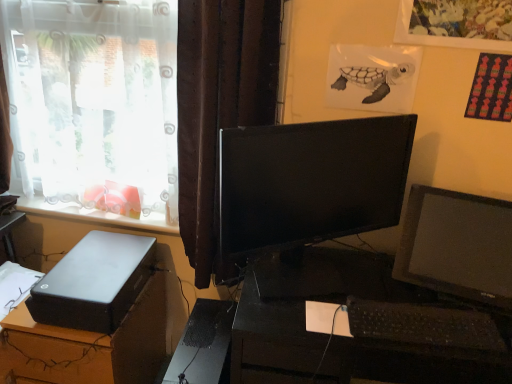
The width and height of the screenshot is (512, 384). Describe the element at coordinates (95, 106) in the screenshot. I see `transparent fabric window at left` at that location.

This screenshot has height=384, width=512. What are the coordinates of `black glossy monitor at center` in the screenshot? It's located at (311, 181).

Find the location of a particular element. white plastic window sill at lower left is located at coordinates (91, 213).

Describe the element at coordinates (91, 213) in the screenshot. This screenshot has width=512, height=384. I see `white plastic window sill at lower left` at that location.

I want to click on black matte computer tower at lower left, so click(x=204, y=345).

The width and height of the screenshot is (512, 384). What do you see at coordinates (204, 345) in the screenshot?
I see `black matte computer tower at lower left` at bounding box center [204, 345].

Locate an element on the screen. The image size is (512, 384). satin black desktop at lower left, which is counted as the first desk, starting from the left is located at coordinates (89, 345).

What do you see at coordinates (304, 307) in the screenshot? This screenshot has width=512, height=384. I see `black plastic desk at center, the second desk from the left` at bounding box center [304, 307].

Where is `matte black hard drive at lower left`? matte black hard drive at lower left is located at coordinates (94, 282).

Identify the location of transparent fabric window at left. (95, 106).

Which of these two, satin black desktop at lower left, which is counted as the 2th desk, starting from the right, or black glossy monitor at center, stands taller?

satin black desktop at lower left, which is counted as the 2th desk, starting from the right, is taller.

Can black glossy monitor at center be found inside satin black desktop at lower left, which is counted as the 2th desk, starting from the right?

No.

Is satin black desktop at lower left, which is counted as the first desk, starting from the left, in front of black glossy monitor at center?

No, it is behind black glossy monitor at center.

From the image's perspective, between black glossy monitor at center and brown textured curtain at center, which one is located above?

brown textured curtain at center is shown above in the image.

Is black glossy monitor at center to the left of brown textured curtain at center from the viewer's perspective?

No, black glossy monitor at center is not to the left of brown textured curtain at center.

Considering the sizes of black glossy monitor at center and brown textured curtain at center in the image, is black glossy monitor at center taller or shorter than brown textured curtain at center?

Clearly, black glossy monitor at center is shorter compared to brown textured curtain at center.

Between black glossy monitor at center and brown textured curtain at center, which one has larger width?

brown textured curtain at center is wider.

From the image's perspective, is matte black hard drive at lower left located above transparent fabric window at left?

Incorrect, from the image's perspective, matte black hard drive at lower left is lower than transparent fabric window at left.

Is the surface of matte black hard drive at lower left in direct contact with transparent fabric window at left?

matte black hard drive at lower left and transparent fabric window at left are clearly separated.

Is point (131, 262) closer or farther from the camera than point (24, 182)?

Clearly, point (131, 262) is closer to the camera than point (24, 182).

Which of these two, matte black hard drive at lower left or transparent fabric window at left, stands shorter?

Standing shorter between the two is matte black hard drive at lower left.

Which object is closer to the camera taking this photo, black matte computer tower at lower left or transparent fabric window at left?

black matte computer tower at lower left is in front.

Considering the positions of objects black matte computer tower at lower left and transparent fabric window at left in the image provided, who is more to the left, black matte computer tower at lower left or transparent fabric window at left?

Positioned to the left is transparent fabric window at left.

From the picture: Measure the distance from black matte computer tower at lower left to transparent fabric window at left.

black matte computer tower at lower left is 28.64 inches from transparent fabric window at left.

Can we say black matte computer tower at lower left lies outside transparent fabric window at left?

Yes, black matte computer tower at lower left is not within transparent fabric window at left.

From the image's perspective, is black glossy monitor at center located above black plastic keyboard at lower right?

Indeed, from the image's perspective, black glossy monitor at center is shown above black plastic keyboard at lower right.

Is black glossy monitor at center in contact with black plastic keyboard at lower right?

black glossy monitor at center is not next to black plastic keyboard at lower right, and they're not touching.

Is black glossy monitor at center facing towards black plastic keyboard at lower right?

Yes, black glossy monitor at center is turned towards black plastic keyboard at lower right.

Is white plastic window sill at lower left aimed at matte black hard drive at lower left?

No, white plastic window sill at lower left is not aimed at matte black hard drive at lower left.

Who is taller, white plastic window sill at lower left or matte black hard drive at lower left?

matte black hard drive at lower left is taller.

Does white plastic window sill at lower left contain matte black hard drive at lower left?

No, matte black hard drive at lower left is located outside of white plastic window sill at lower left.

Is point (59, 208) farther from viewer compared to point (86, 239)?

Yes.

Between black plastic desk at center, the second desk from the left, and transparent fabric window at left, which one has smaller size?

transparent fabric window at left is smaller.

Is black plastic desk at center, the second desk from the left, facing away from transparent fabric window at left?

black plastic desk at center, the second desk from the left, is not turned away from transparent fabric window at left.

Which object is more forward, black plastic desk at center, which is counted as the 1th desk, starting from the right, or transparent fabric window at left?

black plastic desk at center, which is counted as the 1th desk, starting from the right, is more forward.

Based on the photo, from the image's perspective, between black plastic desk at center, which is counted as the 1th desk, starting from the right, and transparent fabric window at left, who is located below?

black plastic desk at center, which is counted as the 1th desk, starting from the right, is shown below in the image.

Locate an element on the screen. This screenshot has height=384, width=512. computer monitor that is in front of the satin black desktop at lower left, which is counted as the 2th desk, starting from the right is located at coordinates (311, 181).

Find the location of a particular element. The image size is (512, 384). curtain located behind the black glossy monitor at center is located at coordinates (219, 108).

Looking at the image, which one is located further to transparent fabric window at left, black glossy monitor at center or white plastic window sill at lower left?

black glossy monitor at center.

Considering their positions, is black plastic keyboard at lower right positioned closer to matte black hard drive at lower left than black glossy monitor at center?

The object closer to matte black hard drive at lower left is black glossy monitor at center.

Considering their positions, is brown textured curtain at center positioned closer to matte black hard drive at lower left than black matte computer tower at lower left?

Among the two, black matte computer tower at lower left is located nearer to matte black hard drive at lower left.

Which object lies nearer to the anchor point white plastic window sill at lower left, satin black desktop at lower left, which is counted as the first desk, starting from the left, or matte black hard drive at lower left?

matte black hard drive at lower left is positioned closer to the anchor white plastic window sill at lower left.

Which object lies further to the anchor point black plastic keyboard at lower right, white plastic window sill at lower left or black plastic desk at center, which is counted as the 1th desk, starting from the right?

The object further to black plastic keyboard at lower right is white plastic window sill at lower left.

When comparing their distances from black plastic desk at center, the second desk from the left, does black matte computer tower at lower left or white plastic window sill at lower left seem further?

white plastic window sill at lower left lies further to black plastic desk at center, the second desk from the left, than the other object.

Which object lies further to the anchor point matte black hard drive at lower left, transparent fabric window at left or black plastic desk at center, the second desk from the left?

black plastic desk at center, the second desk from the left, is further to matte black hard drive at lower left.

Looking at the image, which one is located further to black plastic keyboard at lower right, white plastic window sill at lower left or black glossy monitor at center?

The object further to black plastic keyboard at lower right is white plastic window sill at lower left.

This screenshot has height=384, width=512. I want to click on cardboard box between satin black desktop at lower left, which is counted as the 2th desk, starting from the right, and black plastic desk at center, the second desk from the left, from left to right, so click(x=94, y=282).

What are the coordinates of `curtain between transparent fabric window at left and matte black hard drive at lower left in the vertical direction` in the screenshot? It's located at (219, 108).

Where is `curtain between transparent fabric window at left and black glossy monitor at center from left to right`? The width and height of the screenshot is (512, 384). curtain between transparent fabric window at left and black glossy monitor at center from left to right is located at coordinates (219, 108).

The height and width of the screenshot is (384, 512). I want to click on computer tower situated between matte black hard drive at lower left and black glossy monitor at center from left to right, so click(x=204, y=345).